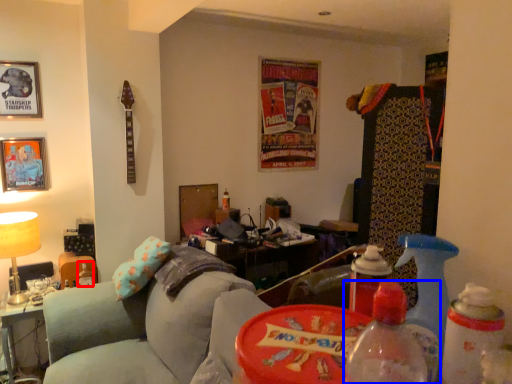
Question: Which point is closer to the camera, bottle (highlighted by a red box) or bottle (highlighted by a blue box)?

Choices:
 (A) bottle
 (B) bottle

Answer: (B)